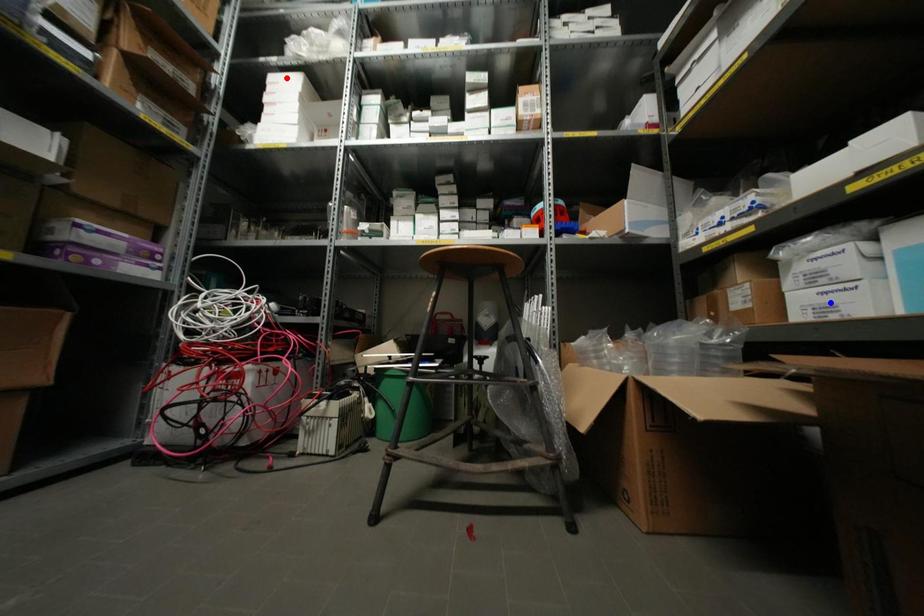
Question: Two points are marked on the image. Which point is closer to the camera?

Choices:
 (A) Blue point is closer.
 (B) Red point is closer.

Answer: (A)